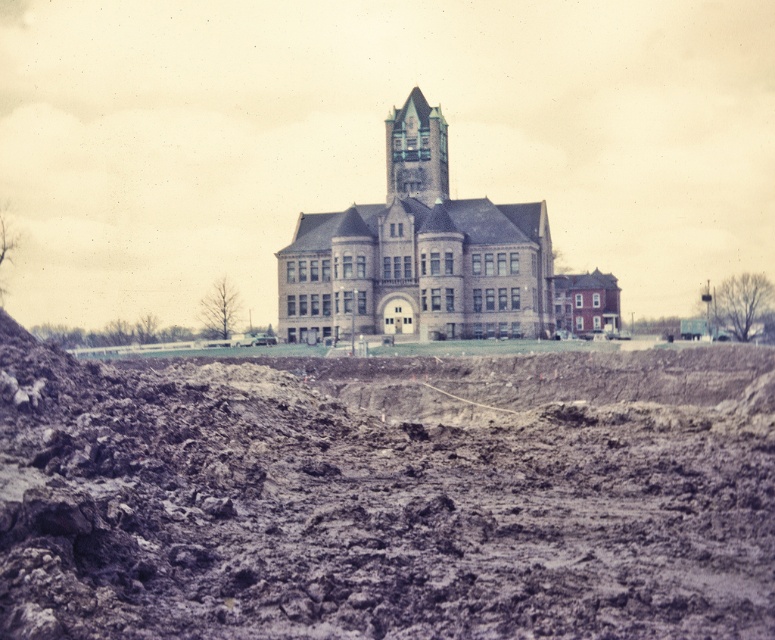
Question: Is brown stone church at center in front of blue glass tower at center?

Choices:
 (A) no
 (B) yes

Answer: (B)

Question: Among these objects, which one is farthest from the camera?

Choices:
 (A) brown stone church at center
 (B) blue glass tower at center
 (C) clayey brown dirt at center

Answer: (B)

Question: Which object appears closest to the camera in this image?

Choices:
 (A) blue glass tower at center
 (B) clayey brown dirt at center

Answer: (B)

Question: Can you confirm if brown stone church at center is positioned below blue glass tower at center?

Choices:
 (A) no
 (B) yes

Answer: (B)

Question: Can you confirm if clayey brown dirt at center is bigger than brown stone church at center?

Choices:
 (A) no
 (B) yes

Answer: (A)

Question: Estimate the real-world distances between objects in this image. Which object is closer to the clayey brown dirt at center?

Choices:
 (A) brown stone church at center
 (B) blue glass tower at center

Answer: (A)